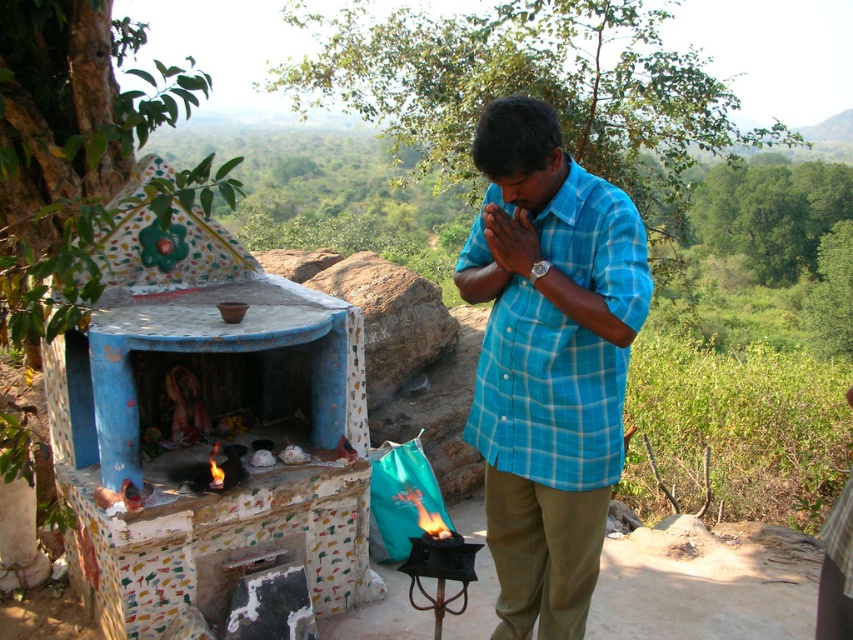
Question: Which of the following is the closest to the observer?

Choices:
 (A) blue plaid shirt at center
 (B) matte blue shirt at center

Answer: (A)

Question: Does blue plaid shirt at center have a larger size compared to matte blue shirt at center?

Choices:
 (A) no
 (B) yes

Answer: (B)

Question: Can you confirm if blue plaid shirt at center is thinner than matte blue shirt at center?

Choices:
 (A) no
 (B) yes

Answer: (A)

Question: Can you confirm if blue plaid shirt at center is wider than matte blue shirt at center?

Choices:
 (A) no
 (B) yes

Answer: (B)

Question: Which of the following is the closest to the observer?

Choices:
 (A) (525, 232)
 (B) (515, 627)

Answer: (A)